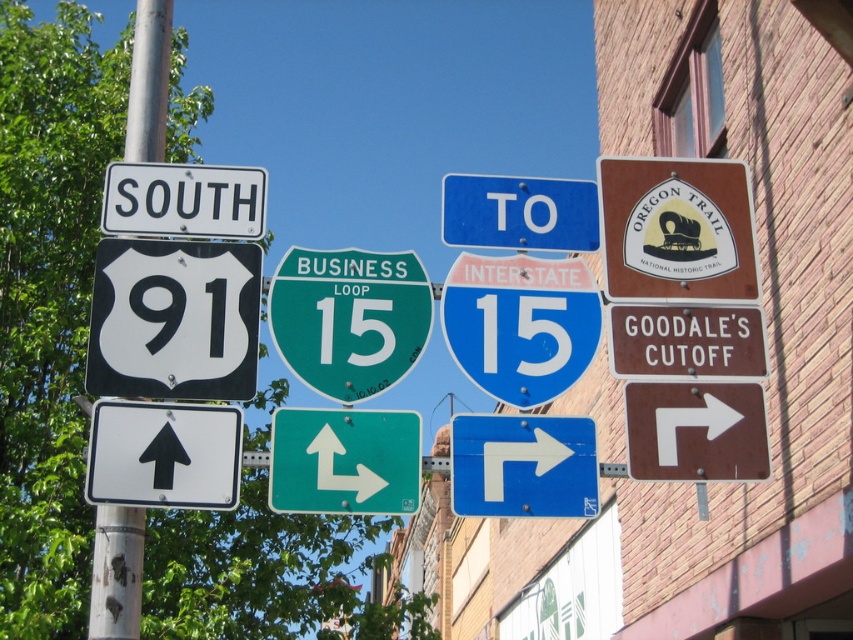
You are a delivery driver approaching the road signs. You need to decide whether to follow the white plastic arrow at upper center or the white plastic arrow at center. Which arrow should you follow first based on their positions?

The white plastic arrow at upper center is in front of the white plastic arrow at center. Therefore, you should follow the white plastic arrow at upper center first since it is closer to you.

You are a pedestrian standing in front of the metallic pole at left and the white plastic arrow at center. Which object is taller?

The metallic pole at left is taller than the white plastic arrow at center.

You are a delivery driver approaching the intersection and need to choose between the metallic pole at left and the white plastic arrow at center. Which object is larger in size?

The metallic pole at left is bigger than the white plastic arrow at center, so the metallic pole at left is larger in size.